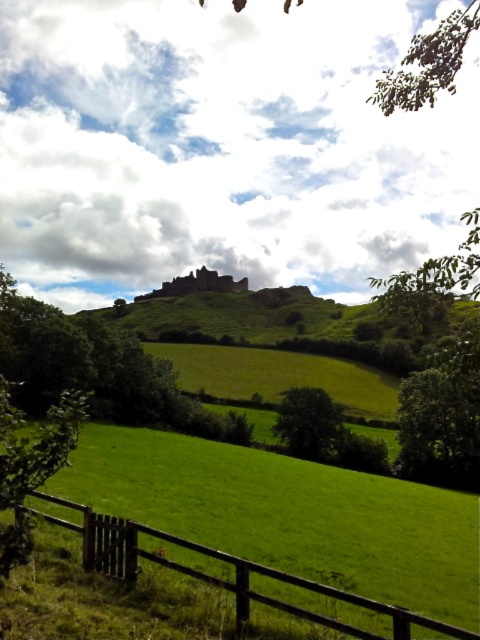
You are standing at the edge of a rural landscape and see the brown wooden fence at lower left and the green leafy tree at center. Which object is positioned to the left of the other?

The brown wooden fence at lower left is to the left of the green leafy tree at center according to the description.

From the picture: You are standing at the edge of the brown wooden fence at lower left and want to walk towards the green leafy tree at center. Which direction should you move relative to the fence?

The brown wooden fence at lower left is above the green leafy tree at center, so you should move downward from the brown wooden fence at lower left to reach the green leafy tree at center.